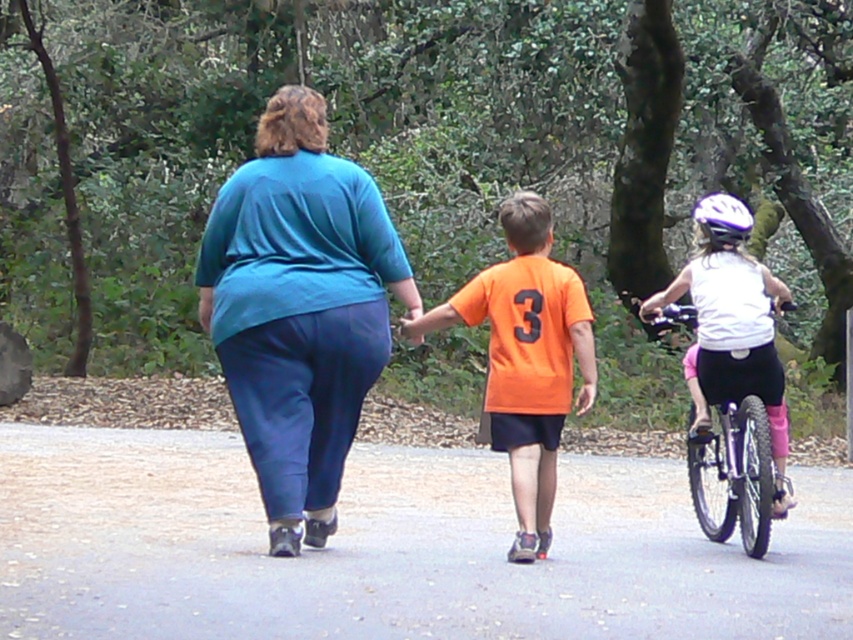
In the scene shown: You are a photographer standing at the edge of the path. You want to take a photo of the teal fabric blouse at center and the white matte bicycle at right. Based on their positions, which object should you focus on first to ensure both are in the frame?

The teal fabric blouse at center is in front of the white matte bicycle at right, so you should focus on the teal fabric blouse at center first to ensure both are in the frame.

In the scene shown: You are planning to paint the gray asphalt road at center and the white matte bicycle helmet at upper center. Which object should you focus on first if you want to paint the smaller one first?

The gray asphalt road at center should be painted first because it occupies less space than the white matte bicycle helmet at upper center according to the description.